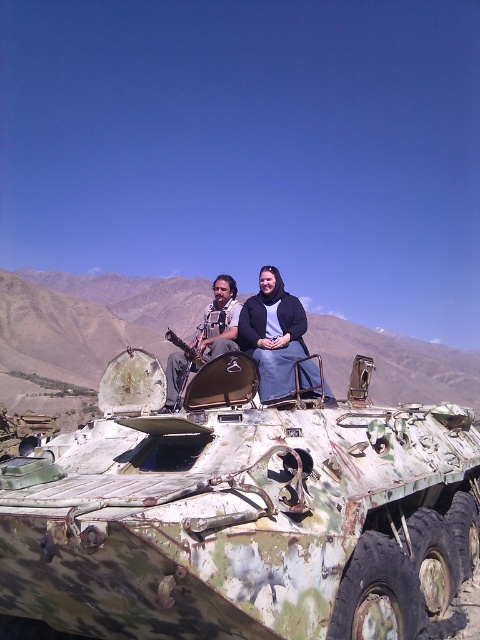
You are a military planner trying to determine the best position for a communication tower. The camouflage paint tank at center is at coordinates point 0.800, 0.502. Considering the terrain and the position of the tank, can you place the tower so it is both visible to the tank and within a 100 meter radius?

The camouflage paint tank at center is located at point (240, 512). To ensure visibility and proximity, the communication tower should be placed within the 100 meter radius around the tank while maintaining a clear line of sight. Since the terrain is mountainous, careful consideration of elevation and obstructions is necessary, but the coordinates allow for such placement.

What are the coordinates of the camouflage paint tank at center?

The camouflage paint tank at center is located at coordinates point (x=240, y=512).

You are a photographer trying to capture the matte black jacket at center and the matte black rifle at upper center in the same frame. Which object should you focus on first if you want to ensure both are in focus without adjusting your camera settings?

The matte black jacket at center is positioned over the matte black rifle at upper center, so focusing on the matte black jacket at center first would ensure both are in focus since it is closer to the camera.